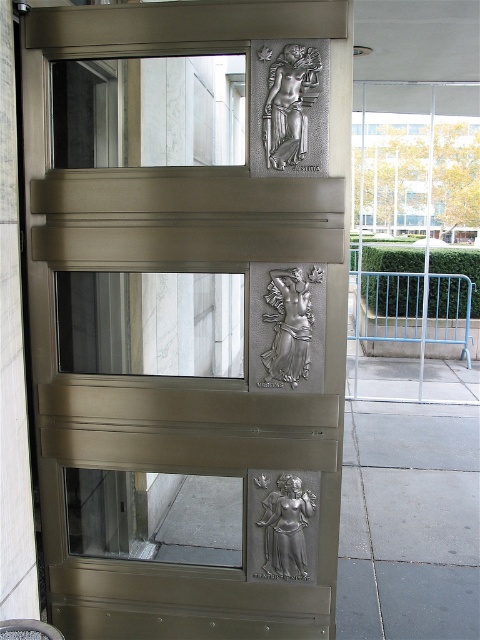
You are standing in front of the building and want to touch both points on the decorative metal door. Which point should you reach for first, the point at coordinates point (442, 204) or point (292, 284)?

You should reach for point (442, 204) first because it is closer to you than point (292, 284), which is further away.